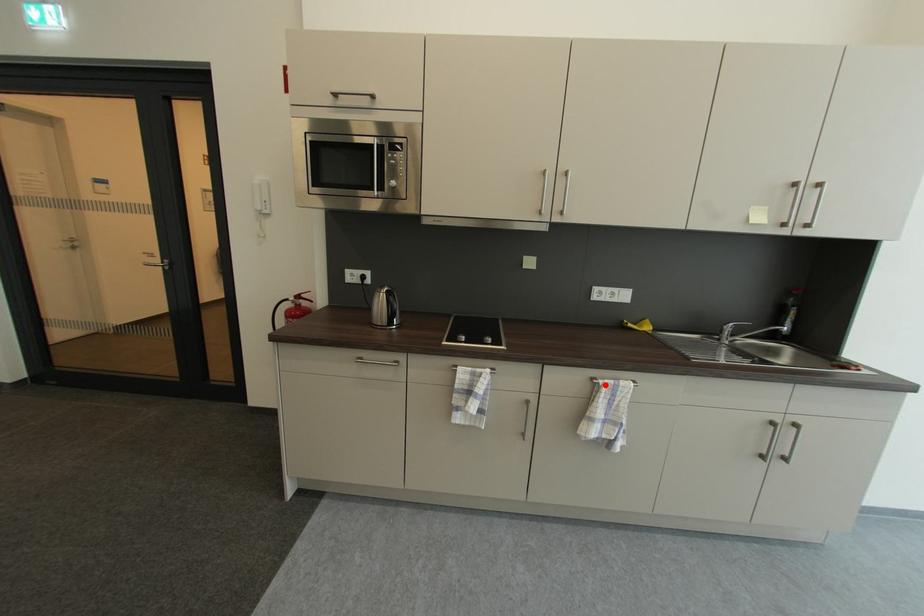
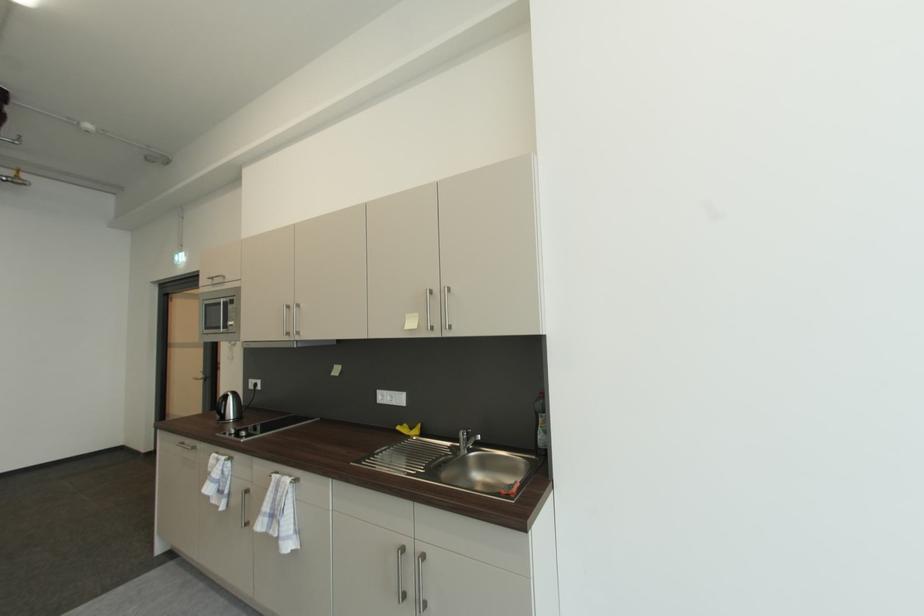
In the second image, find the point that corresponds to the highlighted location in the first image.

(277, 477)